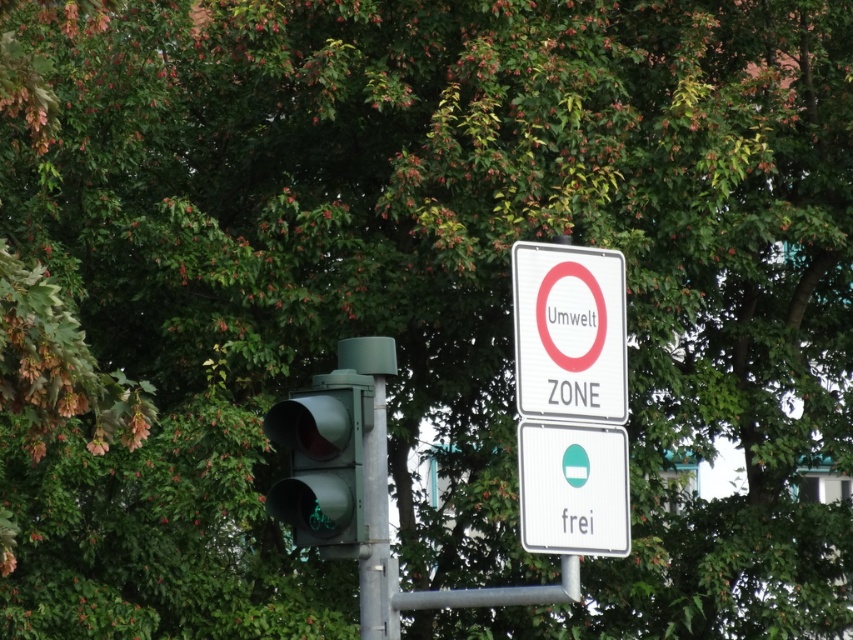
From the picture: You are a delivery driver who needs to know the height difference between the green matte traffic light at center and the white plastic sign at center. Which one is taller?

The green matte traffic light at center is much taller than the white plastic sign at center.

You are standing at the viewpoint of the image and want to walk towards the point at coordinates (610, 369). Is this point closer to you or farther away than 10 meters?

The point at coordinates (610, 369) is 11.35 meters away from the viewer, so it is farther than 10 meters.

What is the color of the sign located at point (569, 332)?

The sign at point (569, 332) is white plastic.